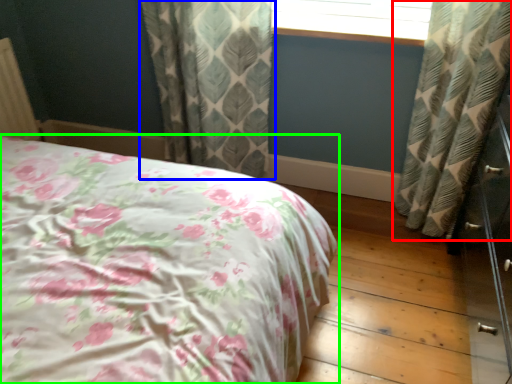
Question: Considering the real-world distances, which object is farthest from curtain (highlighted by a red box)? curtain (highlighted by a blue box) or bed (highlighted by a green box)?

Choices:
 (A) curtain
 (B) bed

Answer: (B)